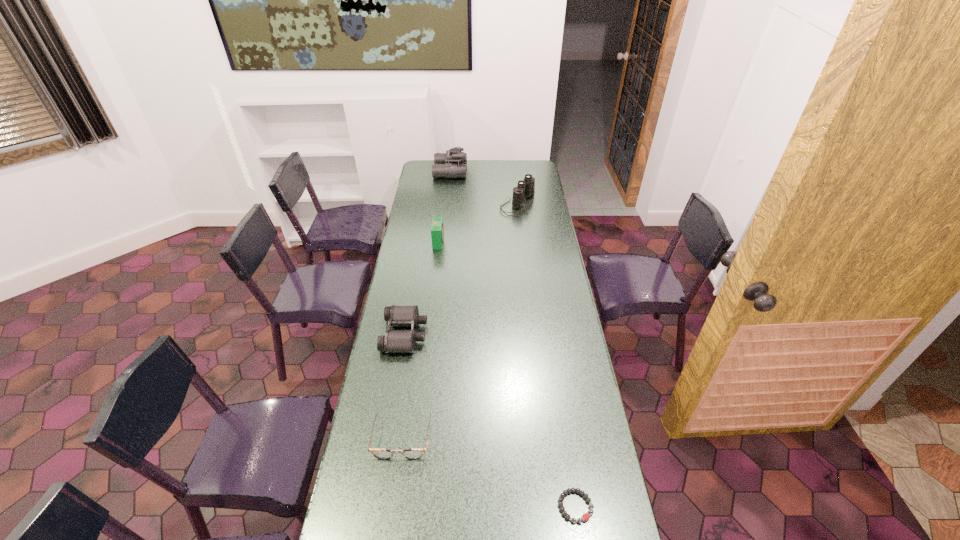
Locate an element on the screen. The width and height of the screenshot is (960, 540). the farthest object is located at coordinates click(452, 164).

The image size is (960, 540). What are the coordinates of `the second farthest binoculars` in the screenshot? It's located at click(x=526, y=188).

In order to click on the rightmost binoculars in this screenshot , I will do `click(526, 188)`.

At what (x,y) coordinates should I click in order to perform the action: click on the fourth shortest object. Please return your answer as a coordinate pair (x, y). Looking at the image, I should click on (437, 230).

Identify the location of alarm clock. (437, 230).

The height and width of the screenshot is (540, 960). Find the location of `the nearest binoculars`. the nearest binoculars is located at coordinates (394, 341).

Locate an element on the screen. the shortest binoculars is located at coordinates (394, 341).

The width and height of the screenshot is (960, 540). In order to click on the second nearest object in this screenshot , I will do `click(378, 453)`.

You are a GUI agent. You are given a task and a screenshot of the screen. Output one action in this format:
    pyautogui.click(x=<x>, y=<y>)
    Task: Click on the second shortest object
    This screenshot has height=540, width=960.
    Given the screenshot: What is the action you would take?
    pyautogui.click(x=378, y=453)

This screenshot has height=540, width=960. I want to click on the nearest object, so click(x=585, y=517).